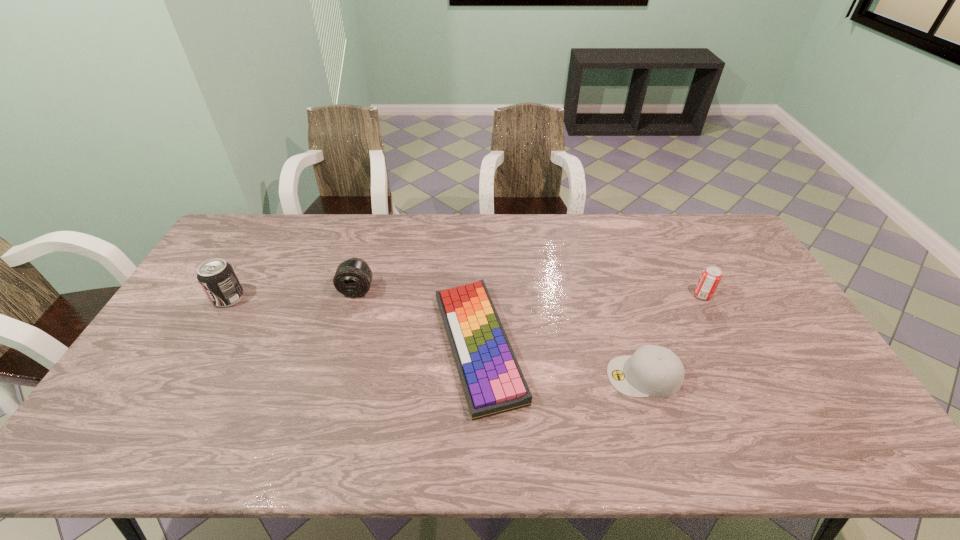
Identify the location of free spot located on the front-facing side of the fourth object from right to left. The image size is (960, 540). 322,413.

Locate an element on the screen. The height and width of the screenshot is (540, 960). vacant space located on the left of the shorter soda can is located at coordinates (x=602, y=295).

Identify the location of blank space located 0.300m on the front-facing side of the second shortest object. [494, 376].

Identify the location of free location located 0.360m on the front-facing side of the second shortest object. (472, 376).

This screenshot has height=540, width=960. Identify the location of free region located 0.200m on the front-facing side of the second shortest object. (533, 376).

Where is `free space located on the right of the computer keyboard`? The image size is (960, 540). free space located on the right of the computer keyboard is located at coordinates (607, 346).

Where is `object present at the left edge`? object present at the left edge is located at coordinates (217, 278).

Locate an element on the screen. This screenshot has height=540, width=960. vacant space at the far edge is located at coordinates (431, 245).

The image size is (960, 540). Find the location of `free space at the near edge of the desktop`. free space at the near edge of the desktop is located at coordinates (482, 445).

This screenshot has height=540, width=960. I want to click on free space at the left edge, so click(165, 347).